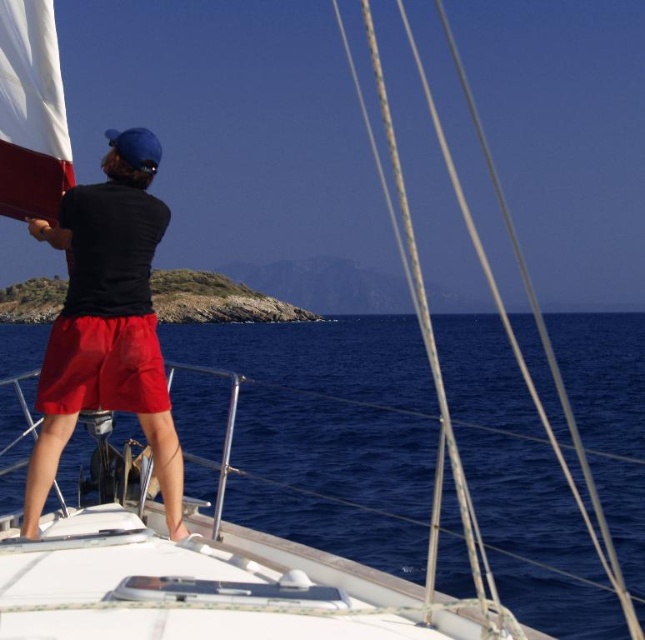
Does black matte shirt at center have a greater width compared to white matte sail at upper left?

Indeed, black matte shirt at center has a greater width compared to white matte sail at upper left.

Is black matte shirt at center thinner than white matte sail at upper left?

Incorrect, black matte shirt at center's width is not less than white matte sail at upper left's.

Find the location of a particular element. black matte shirt at center is located at coordinates (106, 323).

Can you confirm if black matte shirt at center is positioned to the left of matte red shorts at center?

In fact, black matte shirt at center is to the right of matte red shorts at center.

The height and width of the screenshot is (640, 645). What are the coordinates of `black matte shirt at center` in the screenshot? It's located at (106, 323).

You are a GUI agent. You are given a task and a screenshot of the screen. Output one action in this format:
    pyautogui.click(x=<x>, y=<y>)
    Task: Click on the black matte shirt at center
    This screenshot has height=640, width=645.
    Given the screenshot: What is the action you would take?
    pyautogui.click(x=106, y=323)

Between white matte sail at upper left and matte red shorts at center, which one is positioned lower?

Positioned lower is matte red shorts at center.

Is point (68, 253) in front of point (41, 403)?

No, it is behind (41, 403).

Find the location of a particular element. The image size is (645, 640). white matte sail at upper left is located at coordinates (32, 113).